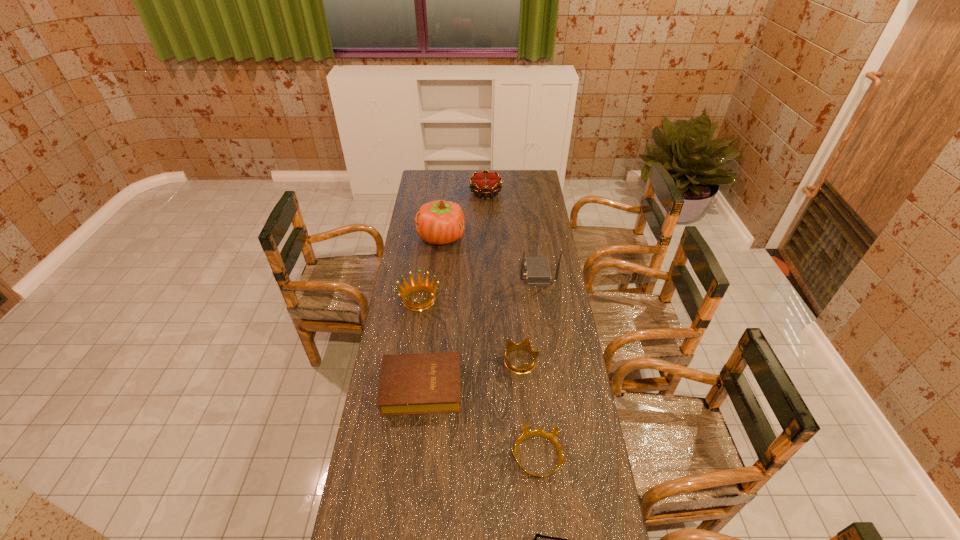
Where is `Bible positioned at the left edge`? Bible positioned at the left edge is located at coordinates (422, 383).

This screenshot has width=960, height=540. I want to click on router present at the right edge, so click(x=537, y=273).

Locate an element on the screen. vacant space at the far edge is located at coordinates (456, 174).

The image size is (960, 540). I want to click on vacant space at the left edge of the desktop, so click(x=416, y=249).

The width and height of the screenshot is (960, 540). In the image, there is a desktop. Find the location of `vacant space at the right edge`. vacant space at the right edge is located at coordinates (611, 525).

You are a GUI agent. You are given a task and a screenshot of the screen. Output one action in this format:
    pyautogui.click(x=<x>, y=<y>)
    Task: Click on the vacant space in between the shortest crown and the farthest object
    This screenshot has height=540, width=960.
    Given the screenshot: What is the action you would take?
    pyautogui.click(x=512, y=325)

I want to click on unoccupied area between the nearest crown and the router, so click(x=537, y=365).

The image size is (960, 540). Identify the location of vacant area that lies between the router and the leftmost crown. (478, 286).

At what (x,y) coordinates should I click in order to perform the action: click on vacant area between the Bible and the farthest object. Please return your answer as a coordinate pair (x, y). The image size is (960, 540). Looking at the image, I should click on (454, 290).

Find the location of a particular element. The width and height of the screenshot is (960, 540). object that can be found as the fifth closest to the second nearest crown is located at coordinates (554, 539).